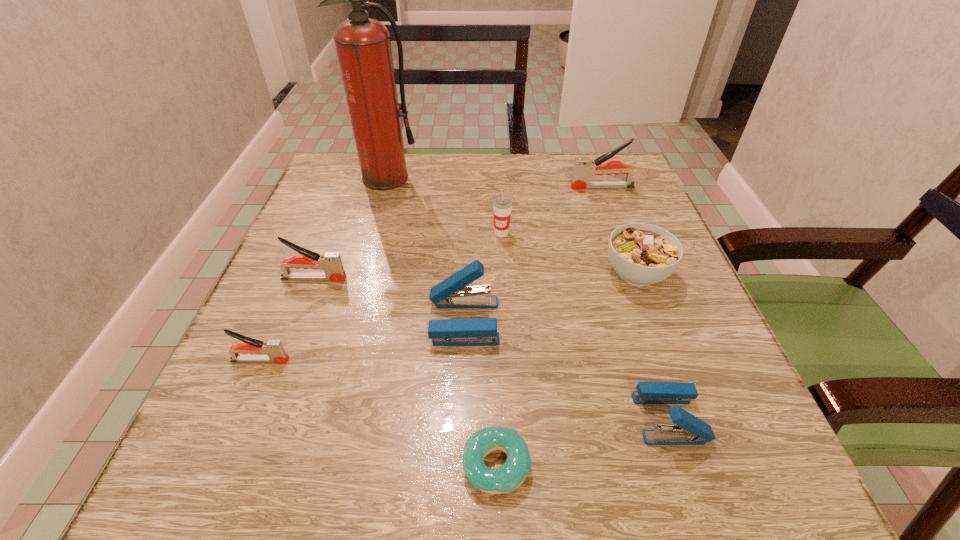
Identify the location of doughnut that is at the near edge. tap(508, 477).

Find the location of `fire extinguisher present at the left edge`. fire extinguisher present at the left edge is located at coordinates (363, 45).

Locate an element on the screen. soup bowl that is at the right edge is located at coordinates (642, 254).

This screenshot has width=960, height=540. What are the coordinates of `object positioned at the far left corner` in the screenshot? It's located at (363, 45).

Find the location of a particular element. This screenshot has width=960, height=540. object that is at the far right corner is located at coordinates point(584,168).

Where is `object that is at the near right corner`? This screenshot has height=540, width=960. object that is at the near right corner is located at coordinates (689, 430).

You are a GUI agent. You are given a task and a screenshot of the screen. Output one action in this format:
    pyautogui.click(x=<x>, y=<y>)
    Task: Click on the free space at the far edge of the desktop
    The image size is (960, 540).
    Given the screenshot: What is the action you would take?
    pyautogui.click(x=566, y=173)

At what (x,y) coordinates should I click in order to perform the action: click on free space at the left edge of the desktop. Please return your answer as a coordinate pair (x, y). Looking at the image, I should click on (336, 295).

Locate an element on the screen. The width and height of the screenshot is (960, 540). vacant area at the right edge of the desktop is located at coordinates (732, 379).

In the image, there is a desktop. Identify the location of vacant space at the far left corner. (325, 197).